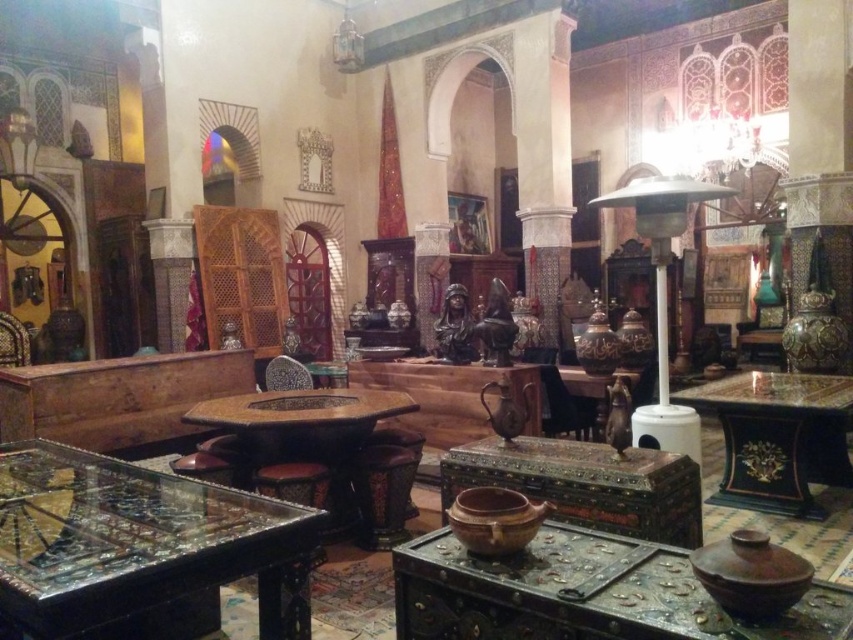
Who is taller, transparent glass table at lower left or brown matte pot at lower right?

With more height is transparent glass table at lower left.

The height and width of the screenshot is (640, 853). Find the location of `transparent glass table at lower left`. transparent glass table at lower left is located at coordinates (140, 548).

Does point (149, 560) come behind point (776, 605)?

Yes, it is.

Locate an element on the screen. This screenshot has height=640, width=853. transparent glass table at lower left is located at coordinates (140, 548).

How far apart are brown leather chest at lower center and brown leather stool at center?

brown leather chest at lower center is 5.48 feet from brown leather stool at center.

Does brown leather chest at lower center have a smaller size compared to brown leather stool at center?

Incorrect, brown leather chest at lower center is not smaller in size than brown leather stool at center.

Is point (663, 563) closer to viewer compared to point (364, 488)?

Yes, it is.

Where is `brown leather chest at lower center`? This screenshot has height=640, width=853. brown leather chest at lower center is located at coordinates (583, 593).

Who is lower down, brown earthenware pot at center or black leather chair at center?

black leather chair at center is below.

How far apart are brown earthenware pot at center and black leather chair at center?

brown earthenware pot at center is 11.35 feet away from black leather chair at center.

Does point (468, 515) come closer to viewer compared to point (576, 435)?

Yes, point (468, 515) is closer to viewer.

Locate an element on the screen. This screenshot has height=640, width=853. brown earthenware pot at center is located at coordinates (495, 518).